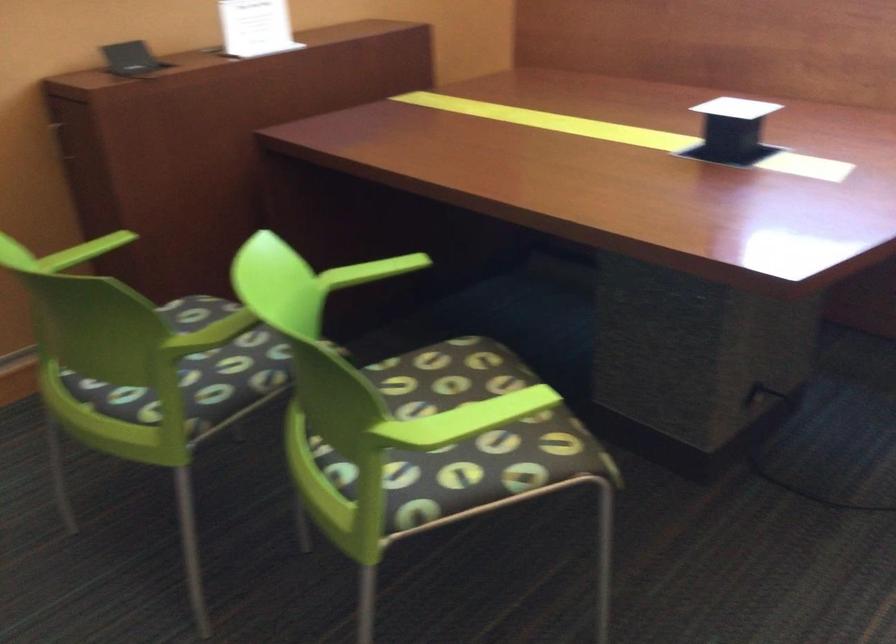
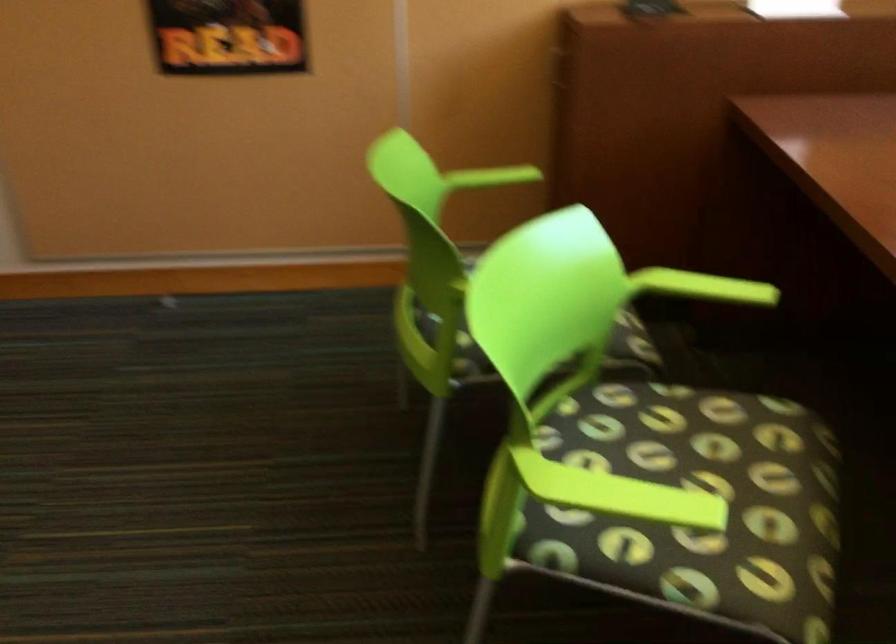
Locate, in the second image, the point that corresponds to pixel 95 250 in the first image.

(497, 176)